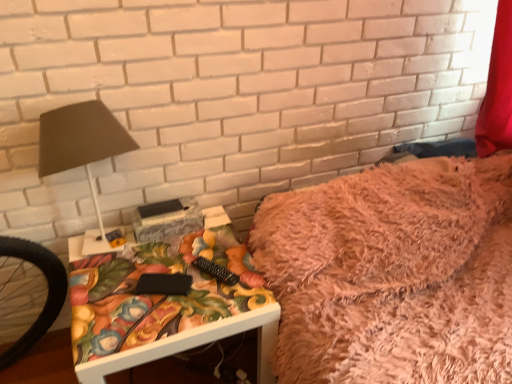
Image resolution: width=512 pixels, height=384 pixels. What are the coordinates of `free location to the right of matte black lamp at left` in the screenshot? It's located at (190, 256).